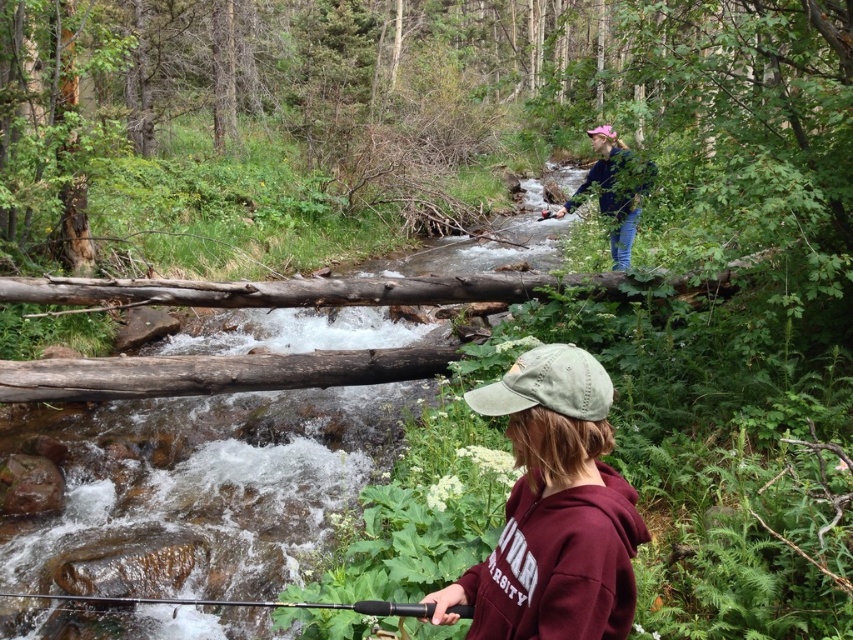
In the scene shown: Who is taller, green cotton cap at lower center or black textured fishing pole at lower center?

green cotton cap at lower center is taller.

In the scene shown: Does green cotton cap at lower center appear over black textured fishing pole at lower center?

Correct, green cotton cap at lower center is located above black textured fishing pole at lower center.

Is point (554, 380) positioned after point (387, 602)?

No, (554, 380) is in front of (387, 602).

Where is `green cotton cap at lower center`? The width and height of the screenshot is (853, 640). green cotton cap at lower center is located at coordinates (554, 509).

Is green fabric baseball cap at lower center closer to the viewer compared to blue jeans at upper center?

Yes, green fabric baseball cap at lower center is in front of blue jeans at upper center.

Who is more distant from viewer, (519, 406) or (566, 204)?

Point (566, 204)

I want to click on green fabric baseball cap at lower center, so click(548, 385).

Find the location of `green fabric baseball cap at lower center`. green fabric baseball cap at lower center is located at coordinates (548, 385).

Which of these two, green cotton cap at lower center or blue jeans at upper center, stands shorter?

Standing shorter between the two is green cotton cap at lower center.

Is green cotton cap at lower center shorter than blue jeans at upper center?

Indeed, green cotton cap at lower center has a lesser height compared to blue jeans at upper center.

Is point (544, 616) farther from camera compared to point (595, 147)?

That is False.

Locate an element on the screen. The width and height of the screenshot is (853, 640). green cotton cap at lower center is located at coordinates click(x=554, y=509).